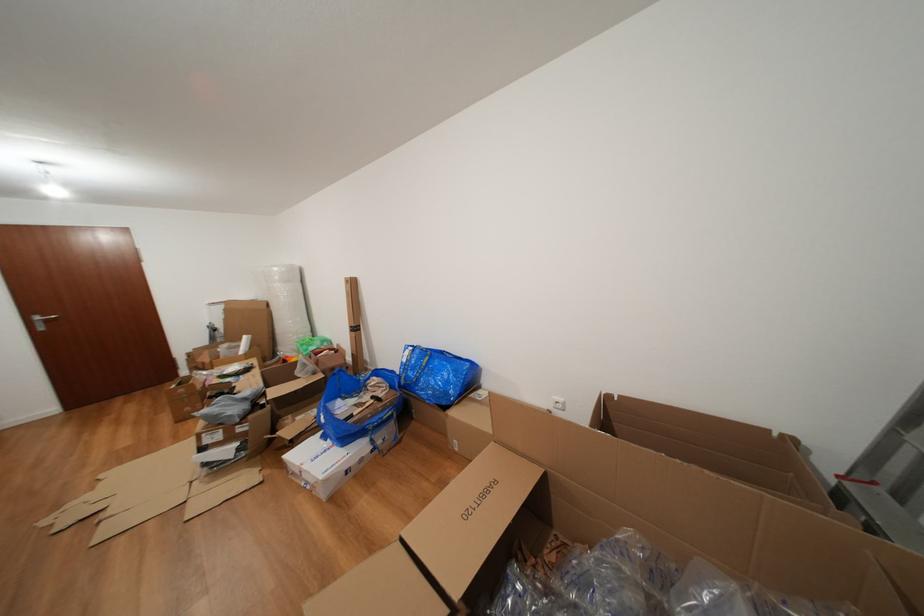
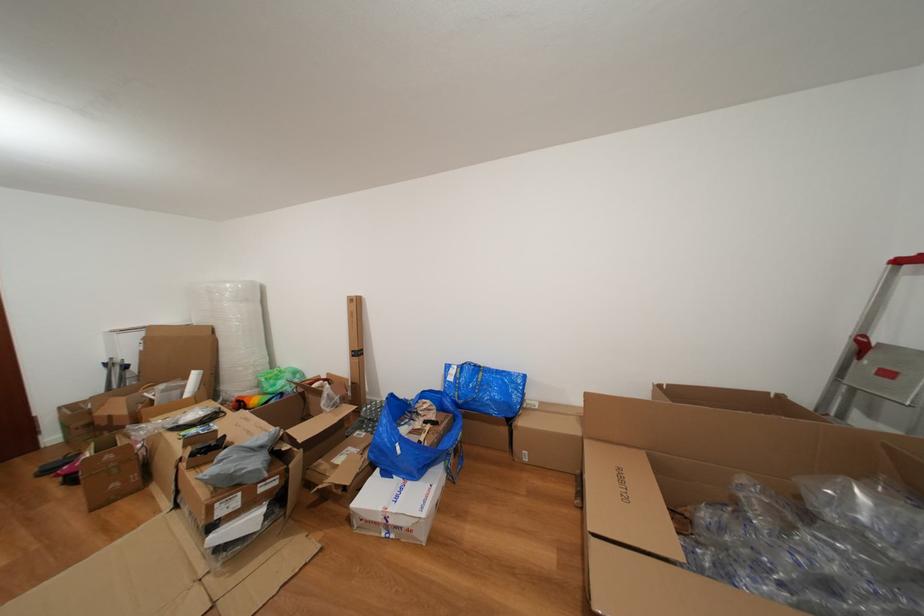
Find the pixel in the second image that matches [368,386] in the first image.

(418, 410)